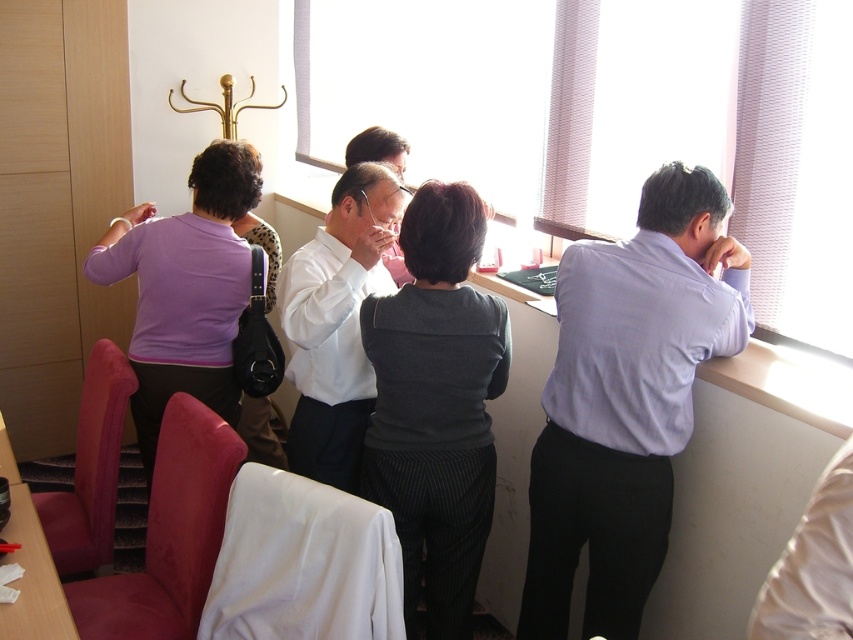
Question: Does transparent glass window at upper center have a smaller size compared to purple matte shirt at left?

Choices:
 (A) no
 (B) yes

Answer: (A)

Question: Does transparent glass window at upper center have a larger size compared to dark gray textured sweater at center?

Choices:
 (A) no
 (B) yes

Answer: (B)

Question: Which is farther from the transparent glass window at upper center?

Choices:
 (A) white glossy shirt at center
 (B) dark gray textured sweater at center

Answer: (B)

Question: Is transparent glass window at upper center thinner than purple matte shirt at left?

Choices:
 (A) no
 (B) yes

Answer: (A)

Question: Which object is closer to the camera taking this photo?

Choices:
 (A) white glossy shirt at center
 (B) purple matte shirt at left
 (C) light blue shirt at right

Answer: (C)

Question: Among these objects, which one is farthest from the camera?

Choices:
 (A) light blue shirt at right
 (B) white glossy shirt at center
 (C) purple matte shirt at left
 (D) transparent glass window at upper center

Answer: (C)